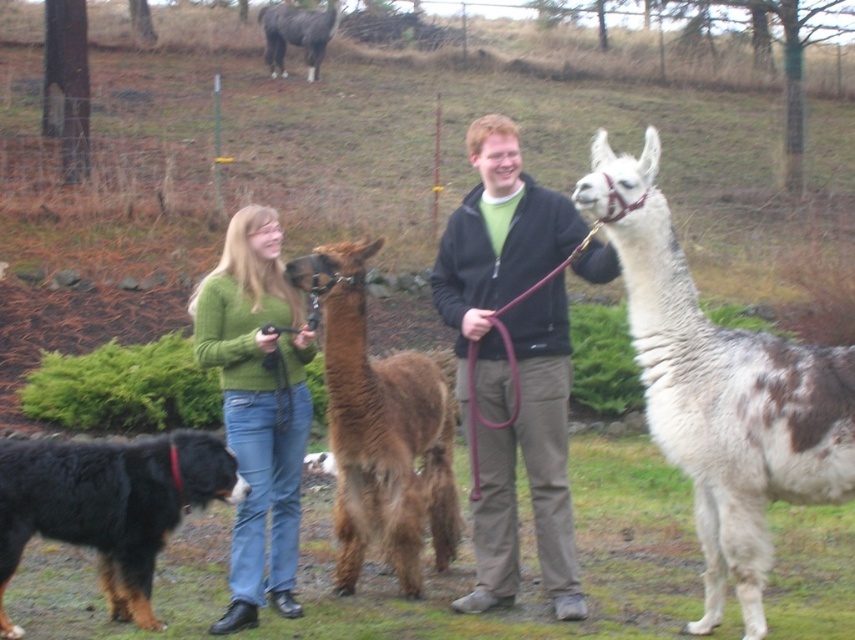
You are standing at the point marked by the coordinates point (x=529, y=467) in the image. What object are you touching?

The point (x=529, y=467) is on the dark brown leather jacket at center, so you are touching the dark brown leather jacket at center.

You are a photographer trying to capture a clear photo of the black fur dog at lower left and the purple leather leash at center. Which object should you focus on first if you want to ensure both are in focus?

The black fur dog at lower left is below the purple leather leash at center, so you should focus on the purple leather leash at center first since it is closer to the camera.